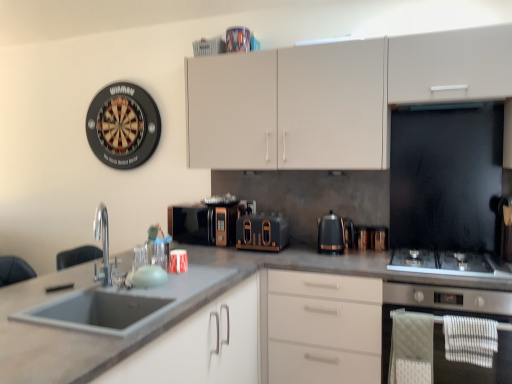
Question: Should I look upward or downward to see polished chrome faucet at sink left?

Choices:
 (A) down
 (B) up

Answer: (A)

Question: In which direction should I rotate to look at metallic silver kettle at center, arranged as the 2th appliance when viewed from the left?

Choices:
 (A) left
 (B) right

Answer: (B)

Question: Is black metallic kettle at center positioned in front of matte black toaster at center, the 1th appliance viewed from the left?

Choices:
 (A) yes
 (B) no

Answer: (A)

Question: Would you say black metallic kettle at center contains matte black toaster at center, the 1th appliance viewed from the left?

Choices:
 (A) no
 (B) yes

Answer: (A)

Question: Considering the relative positions of black metallic kettle at center and matte black toaster at center, marked as the second appliance in a right-to-left arrangement, in the image provided, is black metallic kettle at center to the left of matte black toaster at center, marked as the second appliance in a right-to-left arrangement, from the viewer's perspective?

Choices:
 (A) no
 (B) yes

Answer: (A)

Question: From the image's perspective, would you say black metallic kettle at center is shown under matte black toaster at center, the 1th appliance viewed from the left?

Choices:
 (A) no
 (B) yes

Answer: (A)

Question: Can you confirm if black metallic kettle at center is shorter than matte black toaster at center, marked as the second appliance in a right-to-left arrangement?

Choices:
 (A) no
 (B) yes

Answer: (A)

Question: Is there a large distance between black metallic kettle at center and matte black toaster at center, the 1th appliance viewed from the left?

Choices:
 (A) yes
 (B) no

Answer: (B)

Question: Considering the relative positions of matte white cabinets at upper center, which is counted as the 1th cabinetry, starting from the right, and metallic silver kettle at center, which is the first appliance from right to left, in the image provided, is matte white cabinets at upper center, which is counted as the 1th cabinetry, starting from the right, to the right of metallic silver kettle at center, which is the first appliance from right to left, from the viewer's perspective?

Choices:
 (A) no
 (B) yes

Answer: (A)

Question: Does matte white cabinets at upper center, which is counted as the 1th cabinetry, starting from the right, lie in front of metallic silver kettle at center, which is the first appliance from right to left?

Choices:
 (A) no
 (B) yes

Answer: (B)

Question: Is matte white cabinets at upper center, arranged as the second cabinetry when ordered from the bottom, not within metallic silver kettle at center, arranged as the 2th appliance when viewed from the left?

Choices:
 (A) no
 (B) yes

Answer: (B)

Question: Is matte white cabinets at upper center, which is counted as the 1th cabinetry, starting from the right, not close to metallic silver kettle at center, arranged as the 2th appliance when viewed from the left?

Choices:
 (A) no
 (B) yes

Answer: (A)

Question: Can you confirm if matte white cabinets at upper center, placed as the second cabinetry when sorted from left to right, is smaller than metallic silver kettle at center, which is the first appliance from right to left?

Choices:
 (A) no
 (B) yes

Answer: (A)

Question: Is matte white cabinets at upper center, the first cabinetry viewed from the top, to the left of metallic silver kettle at center, arranged as the 2th appliance when viewed from the left, from the viewer's perspective?

Choices:
 (A) no
 (B) yes

Answer: (B)

Question: Is matte gray sink at lower left, which is the second cabinetry from top to bottom, in front of stainless steel oven at lower right?

Choices:
 (A) no
 (B) yes

Answer: (B)